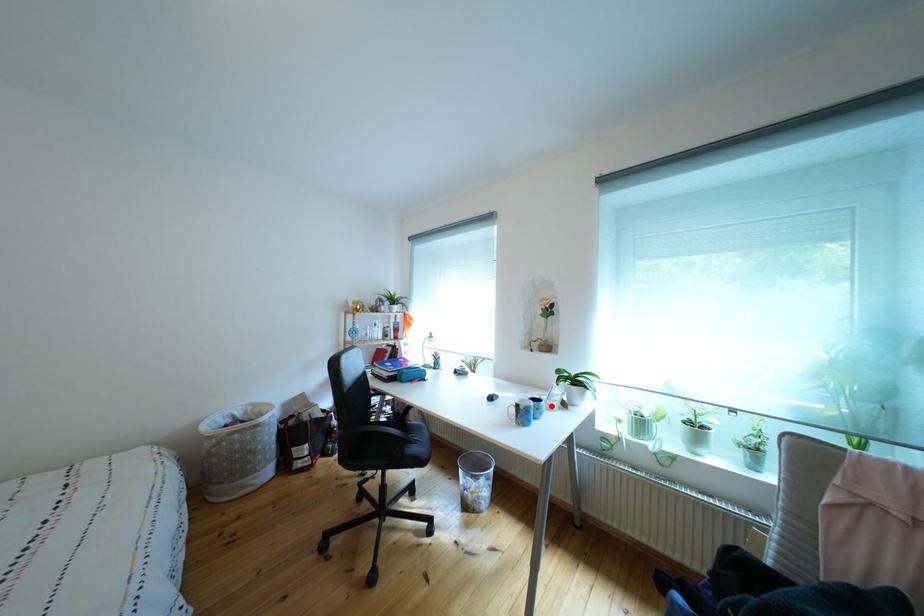
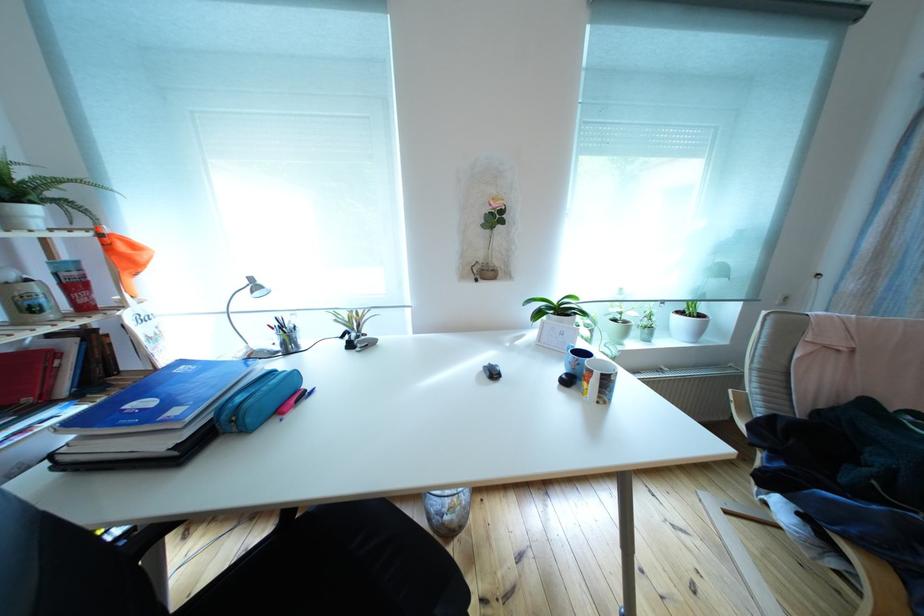
Question: I am providing you with two images of the same scene from different viewpoints. A red point is marked on the first image. Is the red point's position out of view in image 2?

Choices:
 (A) Yes
 (B) No

Answer: (A)